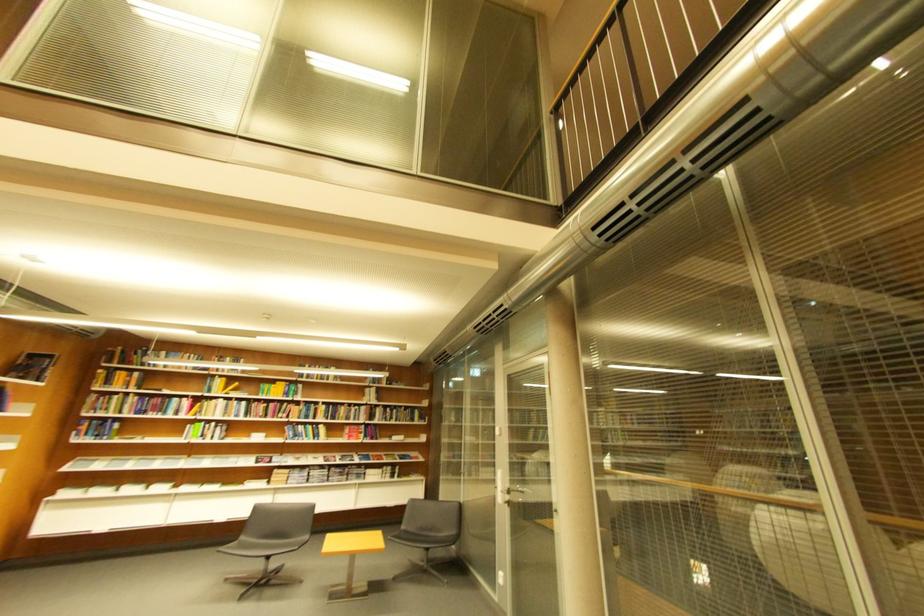
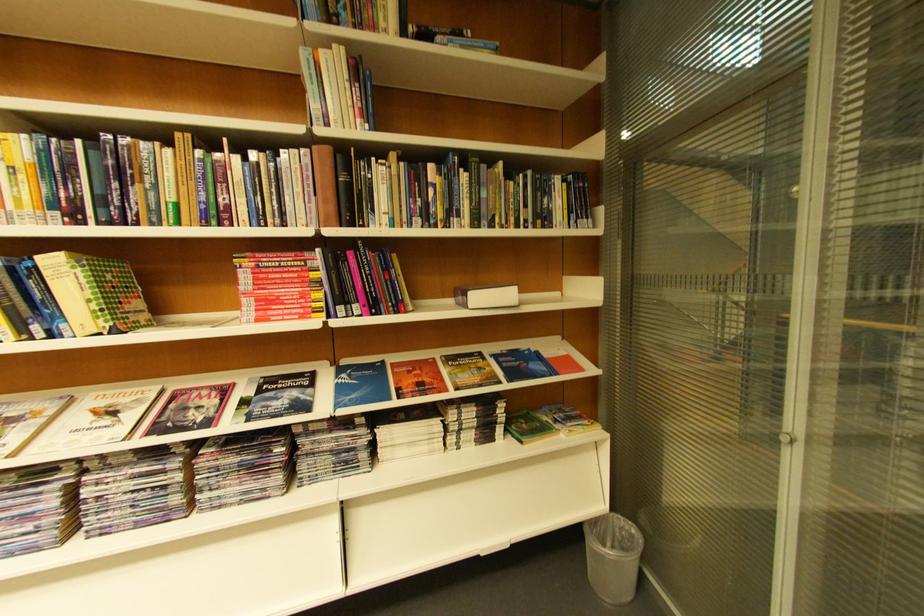
Find the pixel in the second image that matches [362,429] in the first image.

(281, 262)